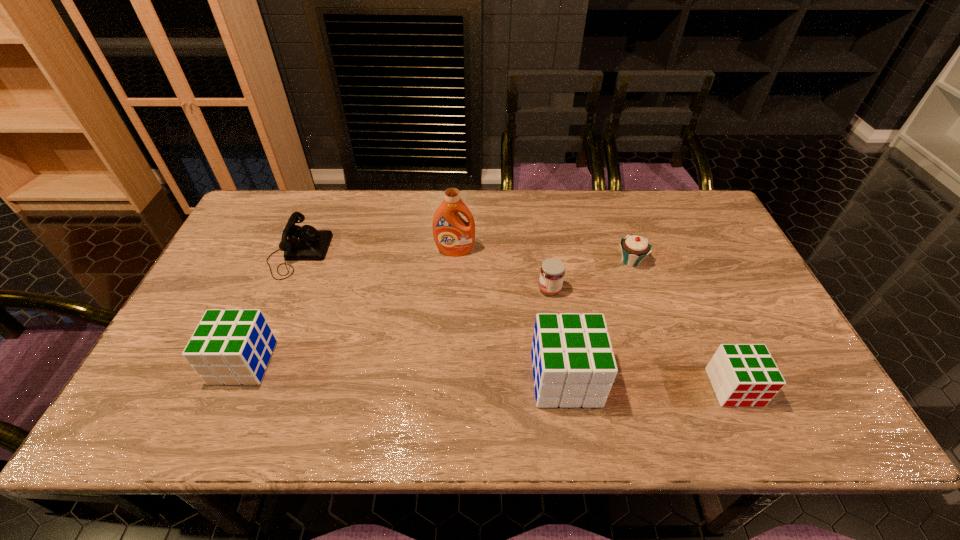
Identify the location of free spot between the rightmost object and the fourth nearest object. (642, 339).

Identify the location of blank region between the telephone and the fourth nearest object. (424, 272).

Image resolution: width=960 pixels, height=540 pixels. Identify the location of vacant area between the leftmost cube and the tallest cube. (404, 370).

I want to click on free space between the fifth object from right to left and the fourth nearest object, so click(x=502, y=271).

This screenshot has height=540, width=960. Identify the location of blank region between the second tallest cube and the second tallest object. (404, 370).

At what (x,y) coordinates should I click in order to perform the action: click on free space between the shortest cube and the fourth farthest object. Please return your answer as a coordinate pair (x, y). The height and width of the screenshot is (540, 960). Looking at the image, I should click on (642, 339).

Find the location of `vacant point located between the cupcake and the tallest object`. vacant point located between the cupcake and the tallest object is located at coordinates (543, 256).

The height and width of the screenshot is (540, 960). I want to click on free spot between the detergent and the second cube from left to right, so click(511, 315).

At what (x,y) coordinates should I click in order to perform the action: click on vacant area that lies between the sixth shortest object and the rightmost cube. Please return your answer as a coordinate pair (x, y). The image size is (960, 540). Looking at the image, I should click on (650, 383).

At what (x,y) coordinates should I click in order to perform the action: click on empty location between the jam and the cupcake. Please return your answer as a coordinate pair (x, y). Looking at the image, I should click on (590, 275).